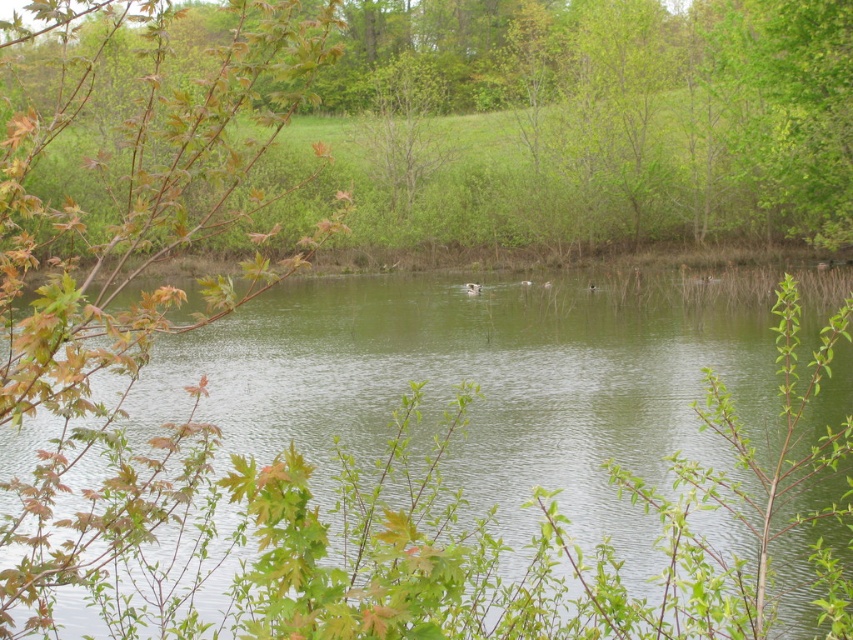
What do you see at coordinates (788, 108) in the screenshot? I see `green leafy tree at upper right` at bounding box center [788, 108].

Which is in front, point (848, 102) or point (476, 285)?

Point (848, 102) is more forward.

What do you see at coordinates (788, 108) in the screenshot?
I see `green leafy tree at upper right` at bounding box center [788, 108].

In order to click on green leafy tree at upper right in this screenshot , I will do `click(788, 108)`.

In the scene shown: Who is lower down, green leafy branch at upper left or white matte duck at center?

white matte duck at center is lower down.

Does green leafy branch at upper left appear under white matte duck at center?

Actually, green leafy branch at upper left is above white matte duck at center.

Where is `green leafy branch at upper left`? Image resolution: width=853 pixels, height=640 pixels. green leafy branch at upper left is located at coordinates (630, 106).

Image resolution: width=853 pixels, height=640 pixels. Identify the location of green leafy branch at upper left. (630, 106).

Based on the photo, is green smooth water at center smaller than green leafy branch at upper left?

Yes, green smooth water at center is smaller than green leafy branch at upper left.

Who is positioned more to the left, green smooth water at center or green leafy branch at upper left?

green smooth water at center is more to the left.

The width and height of the screenshot is (853, 640). What do you see at coordinates (404, 529) in the screenshot? I see `green smooth water at center` at bounding box center [404, 529].

The width and height of the screenshot is (853, 640). Identify the location of green smooth water at center. (404, 529).